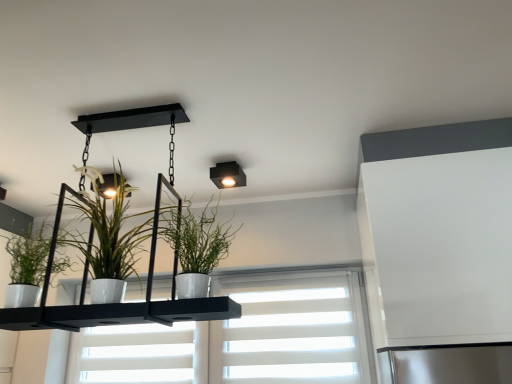
Question: Considering the relative sizes of white glossy pot at center, which appears as the second houseplant when viewed from the right, and matte black square light fixture at upper center in the image provided, is white glossy pot at center, which appears as the second houseplant when viewed from the right, thinner than matte black square light fixture at upper center?

Choices:
 (A) no
 (B) yes

Answer: (A)

Question: From a real-world perspective, is white glossy pot at center, which appears as the second houseplant when viewed from the right, positioned under matte black square light fixture at upper center based on gravity?

Choices:
 (A) yes
 (B) no

Answer: (A)

Question: Is white glossy pot at center, which appears as the second houseplant when viewed from the right, facing away from matte black square light fixture at upper center?

Choices:
 (A) no
 (B) yes

Answer: (B)

Question: Is the position of white glossy pot at center, which appears as the second houseplant when viewed from the right, less distant than that of matte black square light fixture at upper center?

Choices:
 (A) yes
 (B) no

Answer: (A)

Question: Is white glossy pot at center, the 2th houseplant from the left, inside the boundaries of green matte plant at left, placed as the third houseplant when sorted from right to left, or outside?

Choices:
 (A) inside
 (B) outside

Answer: (B)

Question: Is white glossy pot at center, the 2th houseplant from the left, to the left or to the right of green matte plant at left, placed as the third houseplant when sorted from right to left, in the image?

Choices:
 (A) right
 (B) left

Answer: (A)

Question: From their relative heights in the image, would you say white glossy pot at center, which appears as the second houseplant when viewed from the right, is taller or shorter than green matte plant at left, placed as the third houseplant when sorted from right to left?

Choices:
 (A) tall
 (B) short

Answer: (A)

Question: In terms of size, does white glossy pot at center, which appears as the second houseplant when viewed from the right, appear bigger or smaller than green matte plant at left, placed as the third houseplant when sorted from right to left?

Choices:
 (A) big
 (B) small

Answer: (A)

Question: Is white glossy pot at center, the 2th houseplant from the left, taller or shorter than matte black square light fixture at upper center?

Choices:
 (A) tall
 (B) short

Answer: (A)

Question: From a real-world perspective, is white glossy pot at center, the 2th houseplant from the left, physically located above or below matte black square light fixture at upper center?

Choices:
 (A) below
 (B) above

Answer: (A)

Question: In terms of width, does white glossy pot at center, the 2th houseplant from the left, look wider or thinner when compared to matte black square light fixture at upper center?

Choices:
 (A) wide
 (B) thin

Answer: (A)

Question: Considering their positions, is white glossy pot at center, the 2th houseplant from the left, located in front of or behind matte black square light fixture at upper center?

Choices:
 (A) behind
 (B) front

Answer: (B)

Question: In terms of size, does green matte plant at left, the first houseplant from the left, appear bigger or smaller than matte black square light fixture at upper center?

Choices:
 (A) big
 (B) small

Answer: (A)

Question: Is green matte plant at left, the first houseplant from the left, wider or thinner than matte black square light fixture at upper center?

Choices:
 (A) wide
 (B) thin

Answer: (B)